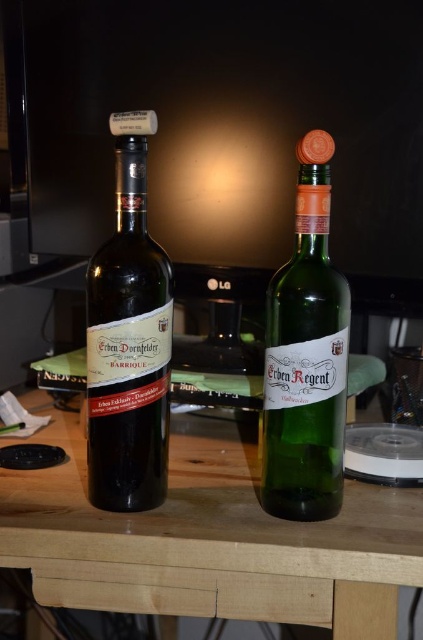
This screenshot has height=640, width=423. What do you see at coordinates (208, 541) in the screenshot?
I see `wooden table at center` at bounding box center [208, 541].

Which is behind, point (16, 483) or point (140, 232)?

The point (16, 483) is more distant.

What do you see at coordinates (208, 541) in the screenshot? The height and width of the screenshot is (640, 423). I see `wooden table at center` at bounding box center [208, 541].

Where is `wooden table at center`? The image size is (423, 640). wooden table at center is located at coordinates tap(208, 541).

Does matte black bottle at left have a larger size compared to green glass bottle at center?

Indeed, matte black bottle at left has a larger size compared to green glass bottle at center.

Between point (148, 394) and point (313, 284), which one is positioned behind?

The point (148, 394) is behind.

Where is `matte black bottle at left`? matte black bottle at left is located at coordinates (129, 340).

Can you confirm if wooden table at center is shorter than green glass bottle at center?

Yes.

Which is more to the right, wooden table at center or green glass bottle at center?

From the viewer's perspective, green glass bottle at center appears more on the right side.

What do you see at coordinates (208, 541) in the screenshot?
I see `wooden table at center` at bounding box center [208, 541].

At what (x,y) coordinates should I click in order to perform the action: click on wooden table at center. Please return your answer as a coordinate pair (x, y). Looking at the image, I should click on (208, 541).